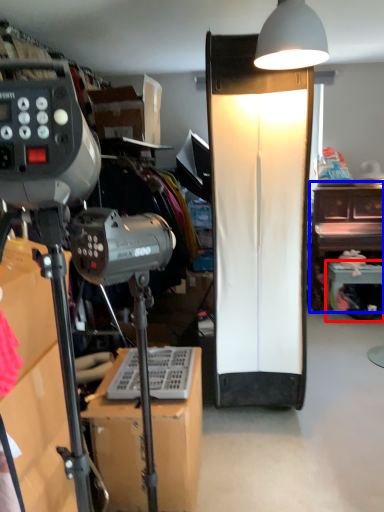
Question: Which point is further to the camera, furniture (highlighted by a red box) or furniture (highlighted by a blue box)?

Choices:
 (A) furniture
 (B) furniture

Answer: (B)